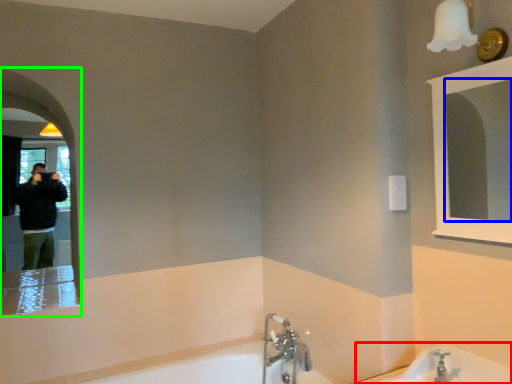
Question: Estimate the real-world distances between objects in this image. Which object is farther from bath (highlighted by a red box), mirror (highlighted by a blue box) or mirror (highlighted by a green box)?

Choices:
 (A) mirror
 (B) mirror

Answer: (A)